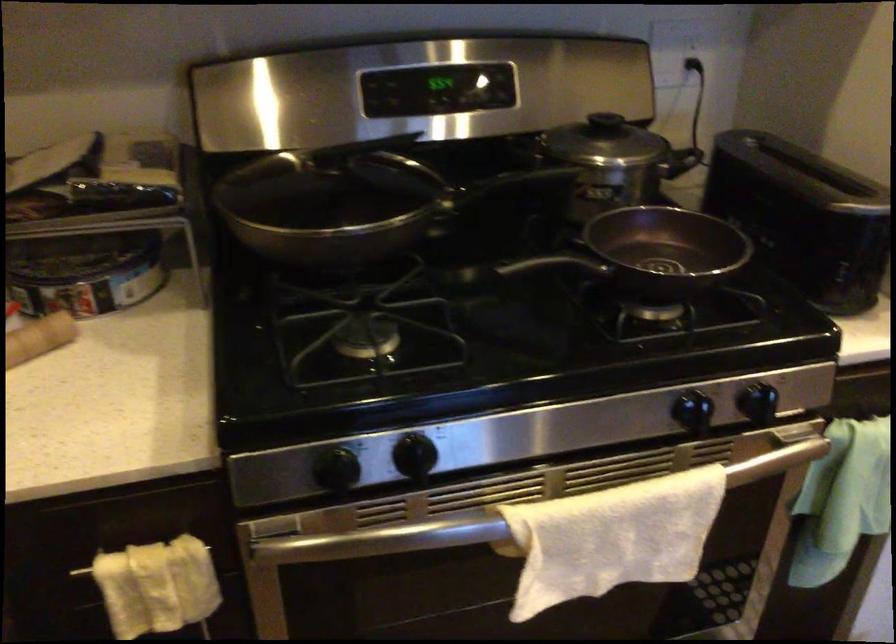
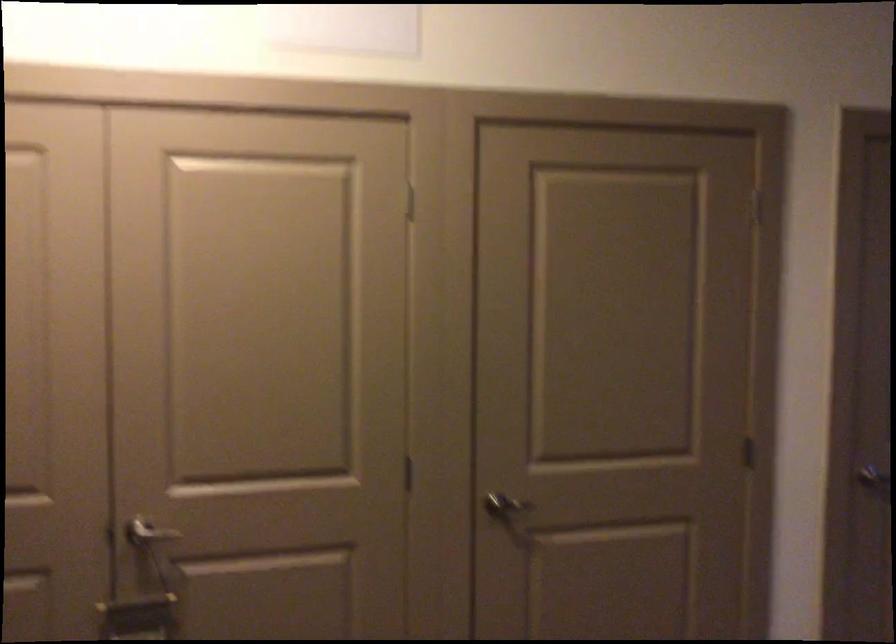
Question: How did the camera likely rotate?

Choices:
 (A) Left
 (B) Right
 (C) Up
 (D) Down

Answer: (B)